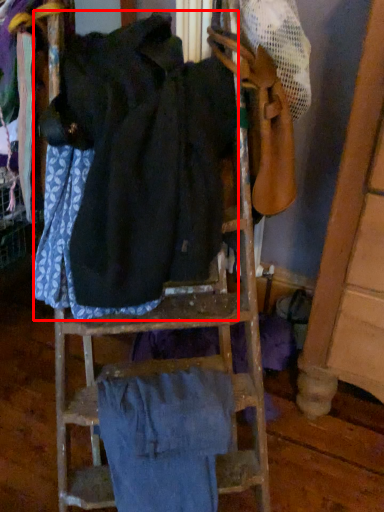
Question: From the image's perspective, what is the correct spatial relationship of wide (annotated by the red box) in relation to wide?

Choices:
 (A) above
 (B) below

Answer: (A)